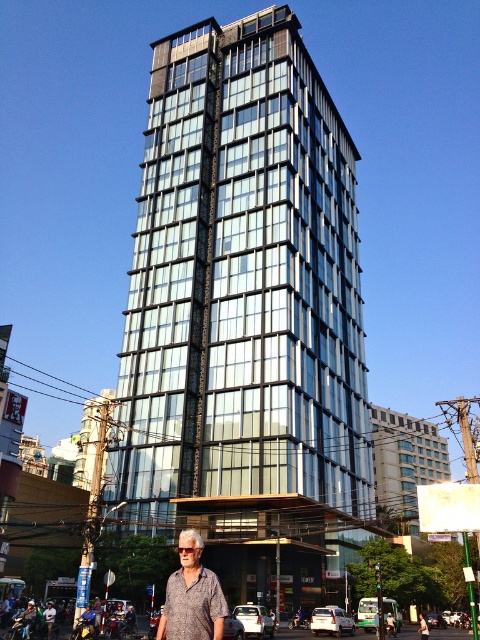
Question: Can you confirm if glassy steel building at center is wider than printed cotton shirt at center?

Choices:
 (A) no
 (B) yes

Answer: (B)

Question: Which object is farther from the camera taking this photo?

Choices:
 (A) glassy steel building at center
 (B) printed cotton shirt at center

Answer: (A)

Question: Which object is farther from the camera taking this photo?

Choices:
 (A) glassy steel building at center
 (B) printed cotton shirt at center

Answer: (A)

Question: Is glassy steel building at center bigger than printed cotton shirt at center?

Choices:
 (A) yes
 (B) no

Answer: (A)

Question: Can you confirm if glassy steel building at center is positioned below printed cotton shirt at center?

Choices:
 (A) no
 (B) yes

Answer: (A)